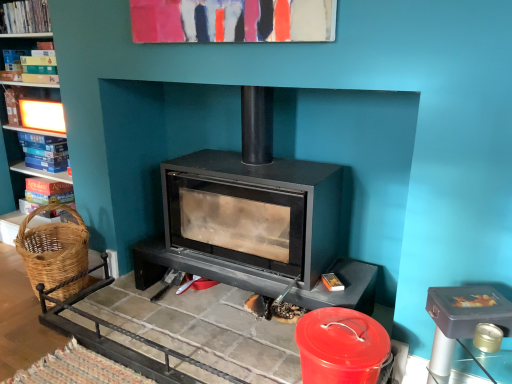
Question: Is matte cardboard book at left, arranged as the first book when ordered from the bottom, situated inside woven brown basket at left or outside?

Choices:
 (A) outside
 (B) inside

Answer: (A)

Question: From the image's perspective, relative to woven brown basket at left, is matte cardboard book at left, placed as the 4th book when sorted from top to bottom, above or below?

Choices:
 (A) above
 (B) below

Answer: (A)

Question: Which object is positioned closest to the hardcover book at left, placed as the third book when sorted from bottom to top?

Choices:
 (A) matte cardboard book at left, arranged as the first book when ordered from the bottom
 (B) blue cardboard book at left, which appears as the third book when viewed from the top
 (C) hardcover book at left, the 1th book viewed from the top
 (D) woven brown basket at left

Answer: (C)

Question: Which object is the closest to the matte cardboard book at left, placed as the 4th book when sorted from top to bottom?

Choices:
 (A) hardcover book at left, the 1th book viewed from the top
 (B) hardcover book at left, placed as the third book when sorted from bottom to top
 (C) woven brown basket at left
 (D) blue cardboard book at left, the 2th book when ordered from bottom to top

Answer: (D)